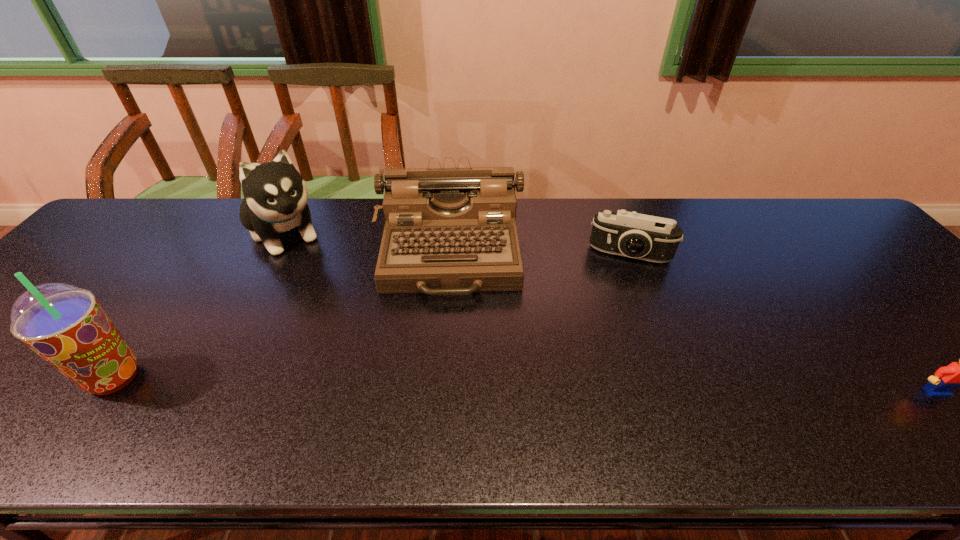
Where is `free spot that satisfies the following two spatial constraints: 1. on the front side of the camera; 2. on the left side of the second object from left to right`? This screenshot has width=960, height=540. free spot that satisfies the following two spatial constraints: 1. on the front side of the camera; 2. on the left side of the second object from left to right is located at coordinates (275, 253).